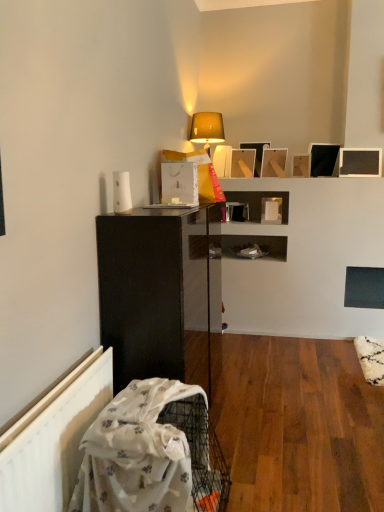
Where is `empty space that is to the right of matte black cabinet at left`? This screenshot has width=384, height=512. empty space that is to the right of matte black cabinet at left is located at coordinates (285, 412).